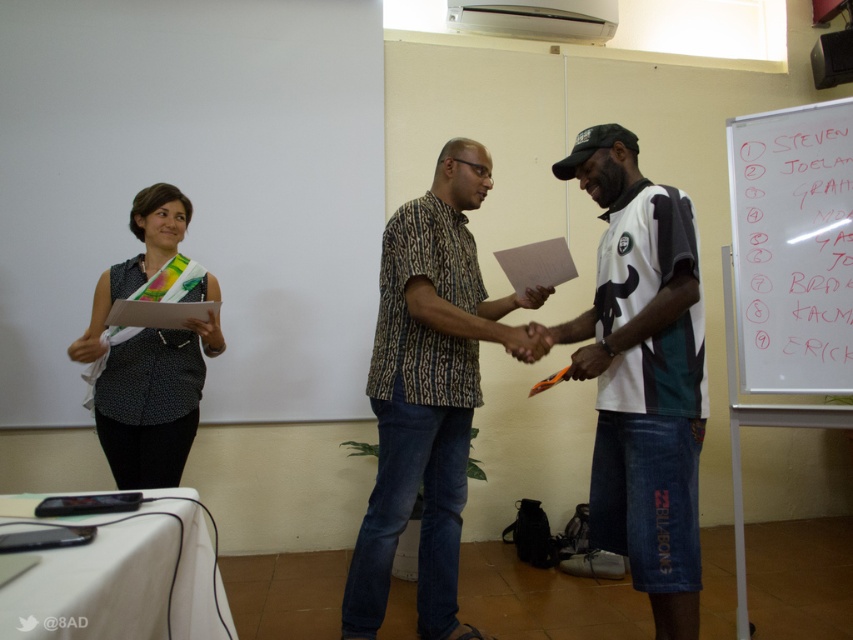
Does patterned fabric shirt at center have a smaller size compared to black dotted shirt at left?

Actually, patterned fabric shirt at center might be larger than black dotted shirt at left.

Does patterned fabric shirt at center have a greater height compared to black dotted shirt at left?

Yes, patterned fabric shirt at center is taller than black dotted shirt at left.

Which is behind, point (454, 252) or point (173, 444)?

Positioned behind is point (173, 444).

Image resolution: width=853 pixels, height=640 pixels. Identify the location of patterned fabric shirt at center. (428, 392).

Is white jersey at center below whiteboard at upper right?

Indeed, white jersey at center is positioned under whiteboard at upper right.

Who is lower down, white jersey at center or whiteboard at upper right?

white jersey at center

Which is behind, point (675, 396) or point (784, 298)?

The point (784, 298) is more distant.

Locate an element on the screen. white jersey at center is located at coordinates (642, 374).

Is white jersey at center positioned at the back of black dotted shirt at left?

No, it is not.

Which is below, white jersey at center or black dotted shirt at left?

white jersey at center is lower down.

This screenshot has height=640, width=853. What are the coordinates of `white jersey at center` in the screenshot? It's located at [x=642, y=374].